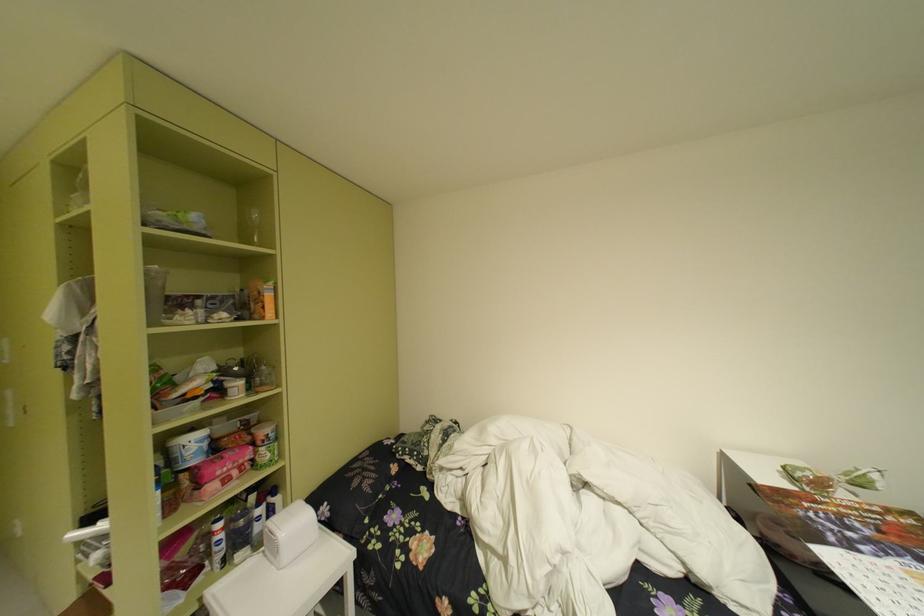
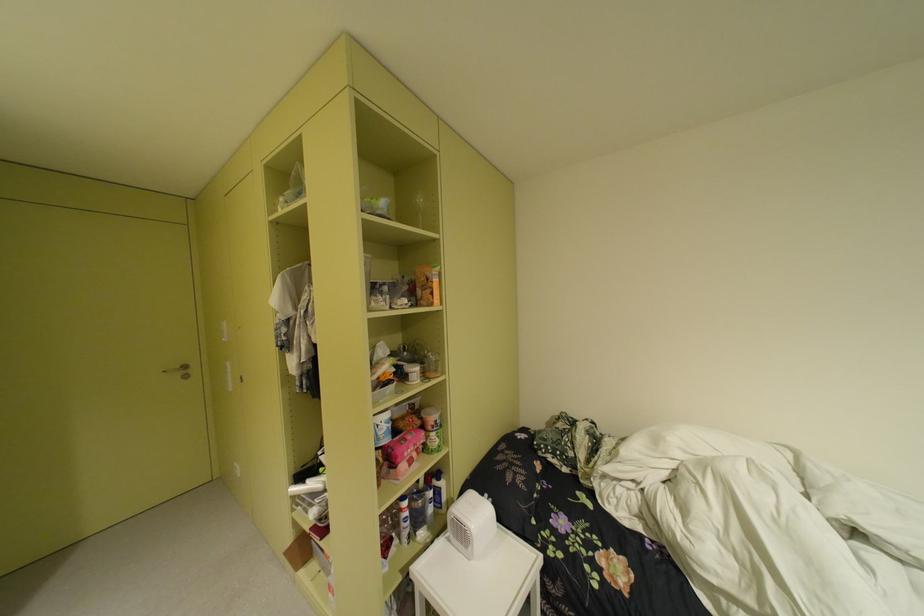
Where in the second image is the point corresponding to pixel 235 315 from the first image?

(417, 301)